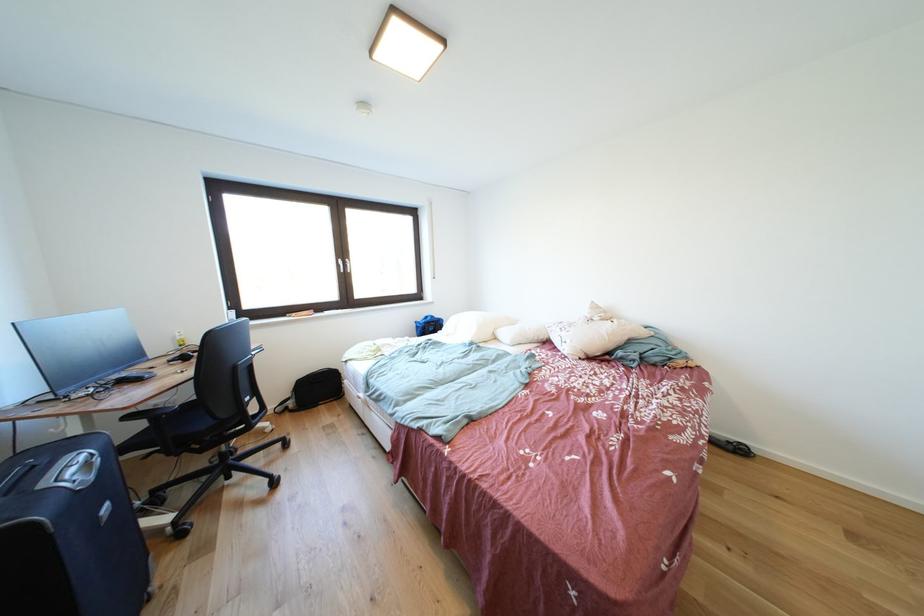
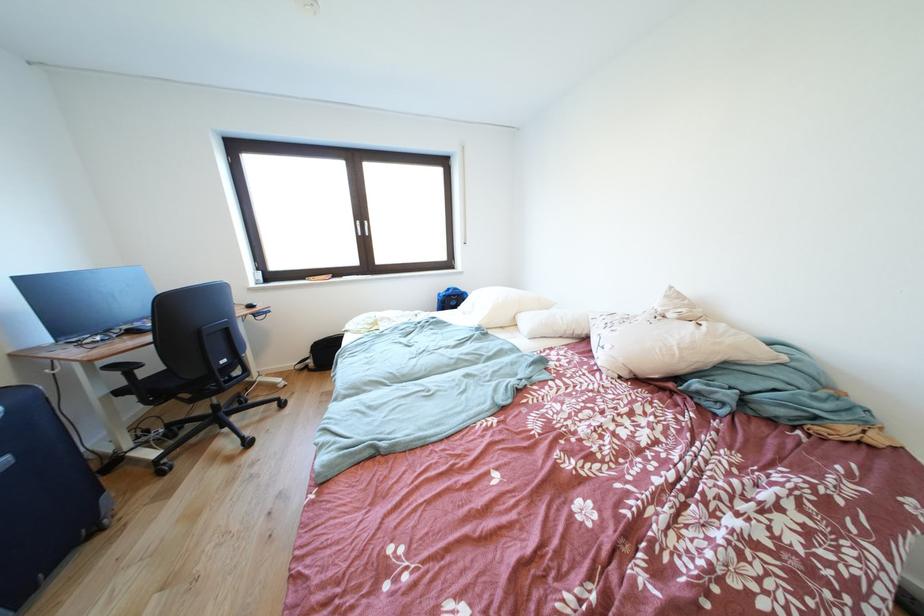
The images are taken continuously from a first-person perspective. In which direction are you moving?

The cameraman moved toward right, forward.